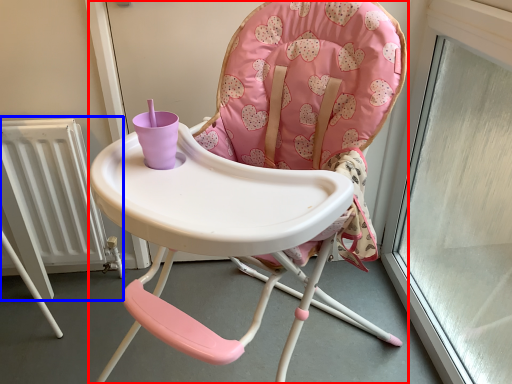
Question: Which point is further to the camera, chair (highlighted by a red box) or radiator (highlighted by a blue box)?

Choices:
 (A) chair
 (B) radiator

Answer: (B)